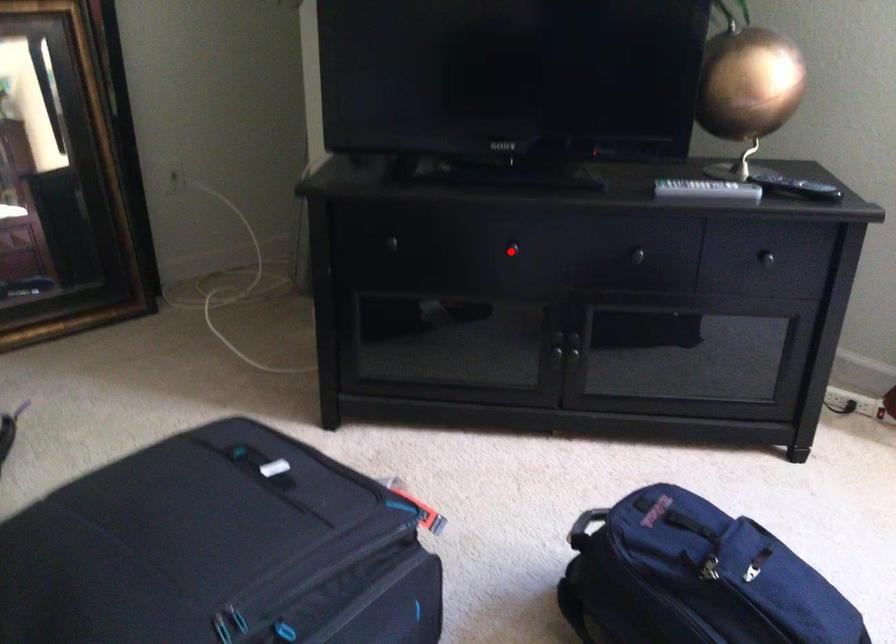
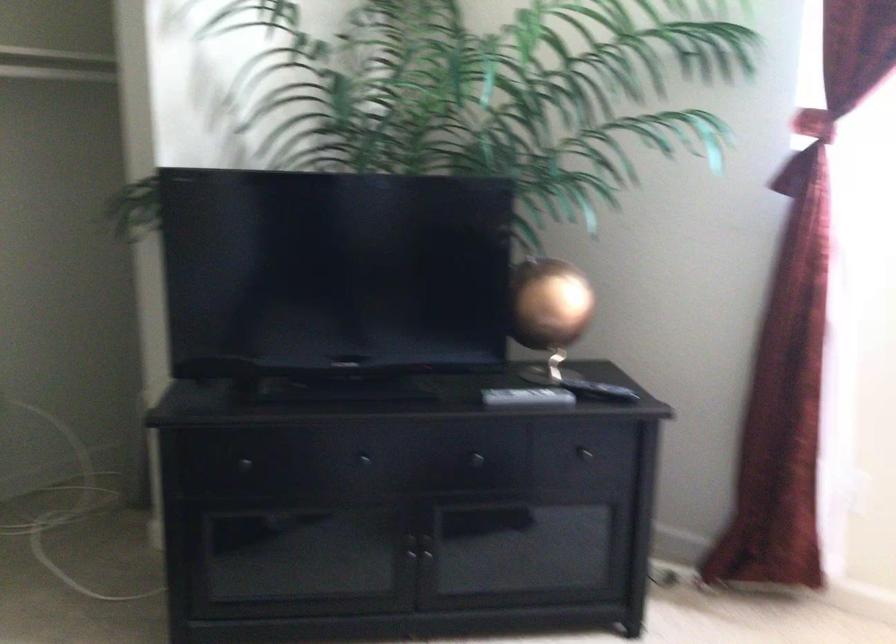
In the second image, find the point that corresponds to the highlighted location in the first image.

(362, 462)